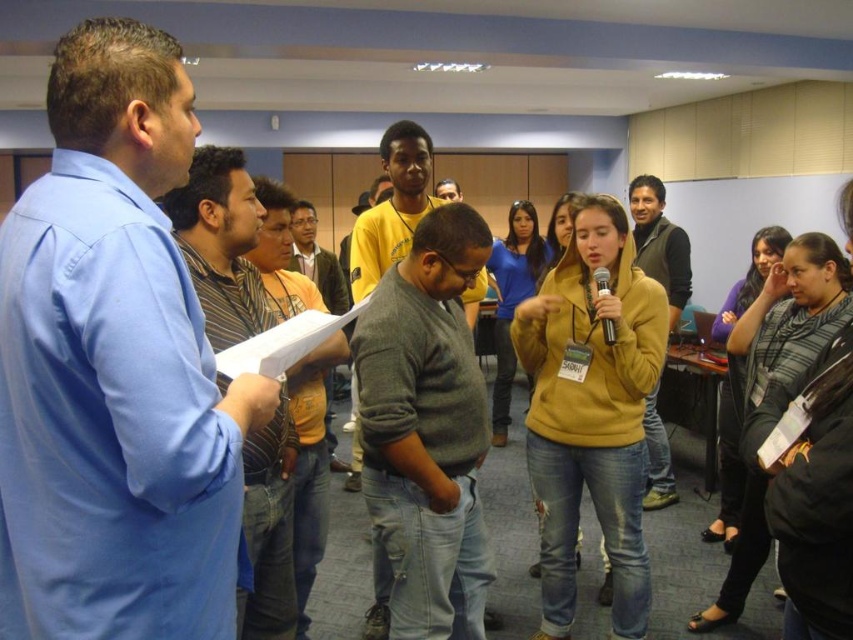
Question: Is blue shirt at left above yellow sweater at center?

Choices:
 (A) no
 (B) yes

Answer: (A)

Question: Which of the following is the closest to the observer?

Choices:
 (A) (300, 464)
 (B) (163, 483)
 (C) (722, 392)

Answer: (B)

Question: Can you confirm if gray sweater at center is wider than black plastic microphone at center?

Choices:
 (A) yes
 (B) no

Answer: (A)

Question: Which point appears farthest from the camera in this image?

Choices:
 (A) (236, 596)
 (B) (343, 289)
 (C) (750, 284)

Answer: (B)

Question: Does striped fabric shirt at center appear on the right side of black plastic microphone at center?

Choices:
 (A) yes
 (B) no

Answer: (B)

Question: Which object is closer to the camera taking this photo?

Choices:
 (A) dark gray sweater at center
 (B) striped shirt at left
 (C) striped fabric shirt at lower right

Answer: (B)